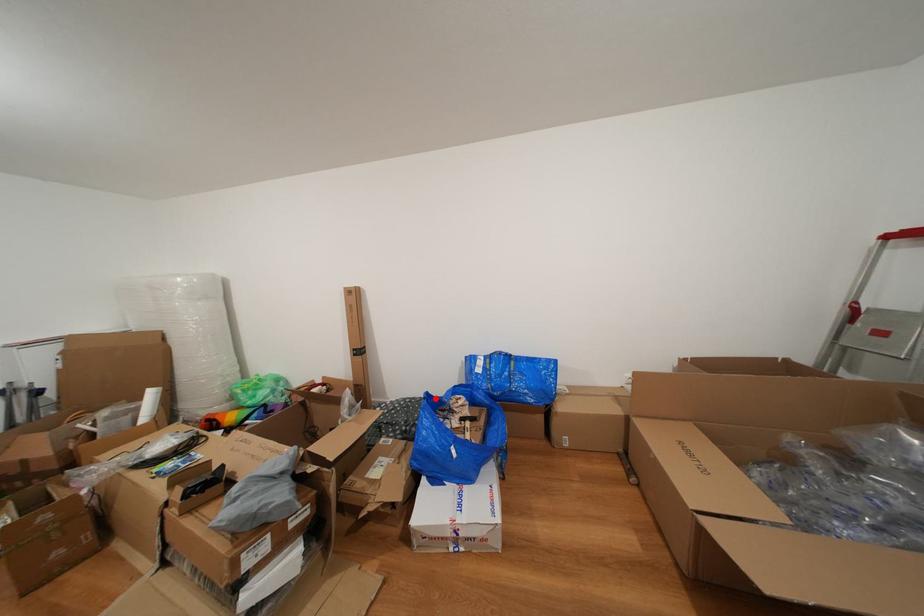
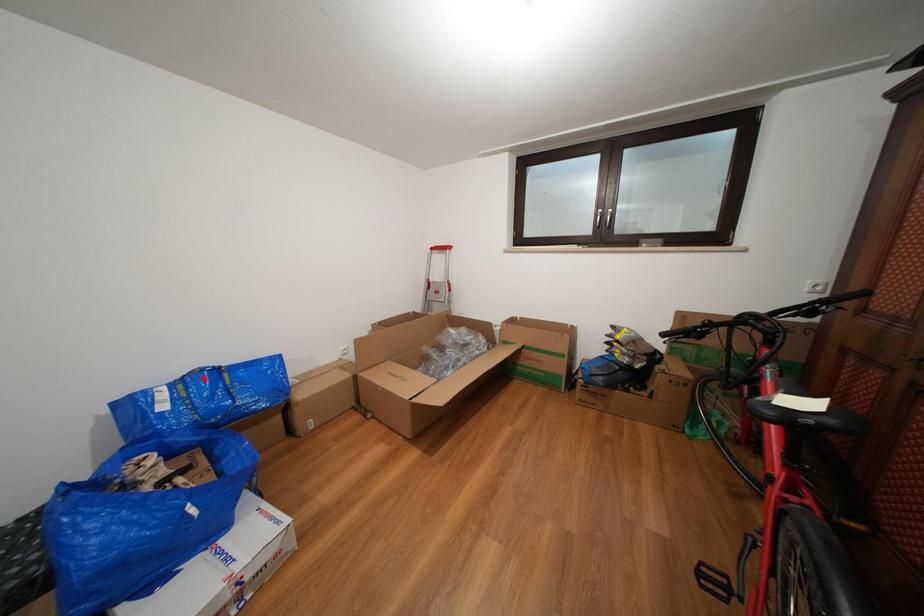
I am providing you with two images of the same scene from different viewpoints. A red point is marked on the first image and another point is marked on the second image. Is the red point in image1 aligned with the point shown in image2?

No